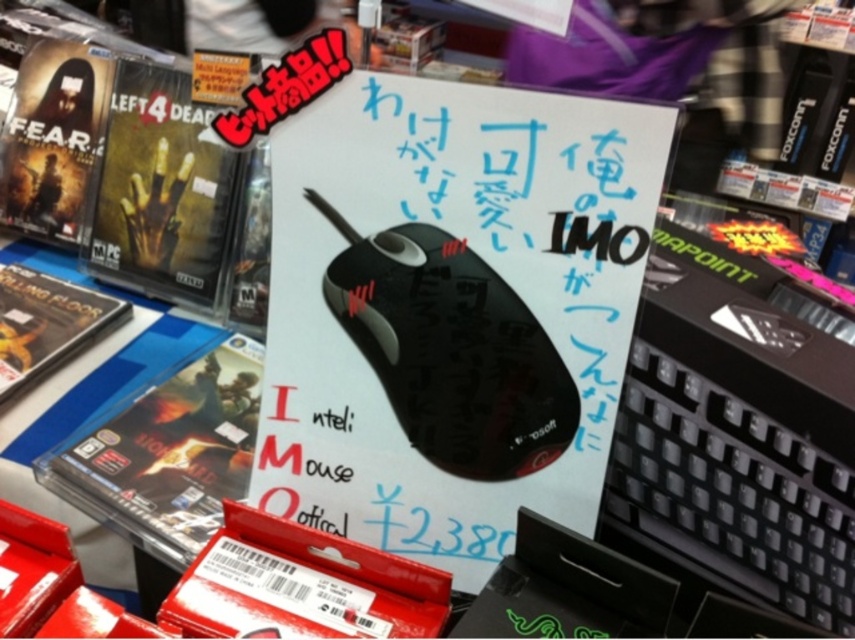
Question: Can you confirm if black plastic keyboard at center-right is thinner than black matte optical mouse at center?

Choices:
 (A) no
 (B) yes

Answer: (B)

Question: Does black plastic keyboard at center-right appear on the left side of black matte optical mouse at center?

Choices:
 (A) yes
 (B) no

Answer: (B)

Question: Which object appears closest to the camera in this image?

Choices:
 (A) black plastic keyboard at center-right
 (B) black matte optical mouse at center

Answer: (A)

Question: Can you confirm if black plastic keyboard at center-right is positioned below black matte optical mouse at center?

Choices:
 (A) yes
 (B) no

Answer: (A)

Question: Which point appears farthest from the camera in this image?

Choices:
 (A) (629, 477)
 (B) (449, 461)

Answer: (B)

Question: Which point is closer to the camera taking this photo?

Choices:
 (A) (491, 268)
 (B) (758, 492)

Answer: (B)